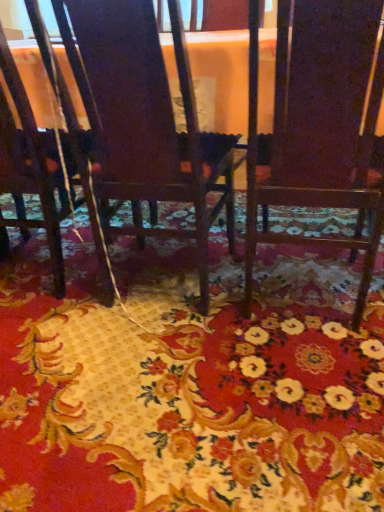
Locate an element on the screen. wooden chair at center, which is counted as the 3th chair, starting from the left is located at coordinates pyautogui.click(x=319, y=123).

What do you see at coordinates (190, 383) in the screenshot?
I see `floral carpet at center` at bounding box center [190, 383].

This screenshot has height=512, width=384. In order to click on wooden chair at center, which is counted as the 3th chair, starting from the left in this screenshot , I will do `click(319, 123)`.

Consider the image. Would you say matte dark wood chair at lower left, which is counted as the first chair, starting from the left, is part of floral carpet at center's contents?

No, matte dark wood chair at lower left, which is counted as the first chair, starting from the left, is not inside floral carpet at center.

How different are the orientations of floral carpet at center and matte dark wood chair at lower left, the third chair positioned from the right, in degrees?

The angular difference between floral carpet at center and matte dark wood chair at lower left, the third chair positioned from the right, is 179 degrees.

From a real-world perspective, does floral carpet at center sit lower than matte dark wood chair at lower left, the third chair positioned from the right?

Yes, from a real-world perspective, floral carpet at center is beneath matte dark wood chair at lower left, the third chair positioned from the right.

From the image's perspective, which is above, floral carpet at center or matte dark wood chair at lower left, the third chair positioned from the right?

From the image's view, matte dark wood chair at lower left, the third chair positioned from the right, is above.

Are wooden chair at center, which is counted as the 3th chair, starting from the left, and matte dark wood chair at lower left, which is counted as the first chair, starting from the left, far apart?

Actually, wooden chair at center, which is counted as the 3th chair, starting from the left, and matte dark wood chair at lower left, which is counted as the first chair, starting from the left, are a little close together.

Where is `the 2nd chair in front of the matte dark wood chair at lower left, which is counted as the first chair, starting from the left`? The image size is (384, 512). the 2nd chair in front of the matte dark wood chair at lower left, which is counted as the first chair, starting from the left is located at coordinates (319, 123).

Who is more distant, wooden chair at center, positioned as the first chair in right-to-left order, or matte dark wood chair at lower left, the third chair positioned from the right?

matte dark wood chair at lower left, the third chair positioned from the right, is behind.

Does wooden chair at center, which is counted as the 3th chair, starting from the left, have a greater width compared to matte dark wood chair at lower left, which is counted as the first chair, starting from the left?

Yes.

Is dark wood chair at center, arranged as the second chair when viewed from the left, completely or partially outside of floral carpet at center?

Absolutely, dark wood chair at center, arranged as the second chair when viewed from the left, is external to floral carpet at center.

How different are the orientations of dark wood chair at center, acting as the second chair starting from the right, and floral carpet at center in degrees?

179 degrees separate the facing orientations of dark wood chair at center, acting as the second chair starting from the right, and floral carpet at center.

Looking at this image, can you confirm if dark wood chair at center, arranged as the second chair when viewed from the left, is smaller than floral carpet at center?

Incorrect, dark wood chair at center, arranged as the second chair when viewed from the left, is not smaller in size than floral carpet at center.

From the image's perspective, is dark wood chair at center, arranged as the second chair when viewed from the left, positioned above or below floral carpet at center?

Clearly, from the image's perspective, dark wood chair at center, arranged as the second chair when viewed from the left, is above floral carpet at center.

Is dark wood chair at center, arranged as the second chair when viewed from the left, looking in the opposite direction of matte dark wood chair at lower left, the third chair positioned from the right?

dark wood chair at center, arranged as the second chair when viewed from the left, is not turned away from matte dark wood chair at lower left, the third chair positioned from the right.

Considering the positions of point (67, 5) and point (1, 164), is point (67, 5) closer or farther from the camera than point (1, 164)?

Point (67, 5).

Considering the relative positions of dark wood chair at center, acting as the second chair starting from the right, and matte dark wood chair at lower left, which is counted as the first chair, starting from the left, in the image provided, is dark wood chair at center, acting as the second chair starting from the right, to the left or to the right of matte dark wood chair at lower left, which is counted as the first chair, starting from the left,?

dark wood chair at center, acting as the second chair starting from the right, is to the right of matte dark wood chair at lower left, which is counted as the first chair, starting from the left.

Is dark wood chair at center, arranged as the second chair when viewed from the left, situated inside matte dark wood chair at lower left, the third chair positioned from the right, or outside?

dark wood chair at center, arranged as the second chair when viewed from the left, is located beyond the bounds of matte dark wood chair at lower left, the third chair positioned from the right.

Considering the sizes of floral carpet at center and wooden chair at center, which is counted as the 3th chair, starting from the left, in the image, is floral carpet at center bigger or smaller than wooden chair at center, which is counted as the 3th chair, starting from the left,?

In the image, floral carpet at center appears to be smaller than wooden chair at center, which is counted as the 3th chair, starting from the left.

Would you say floral carpet at center is inside or outside wooden chair at center, which is counted as the 3th chair, starting from the left?

floral carpet at center is spatially situated outside wooden chair at center, which is counted as the 3th chair, starting from the left.

Does floral carpet at center have a lesser width compared to wooden chair at center, which is counted as the 3th chair, starting from the left?

In fact, floral carpet at center might be wider than wooden chair at center, which is counted as the 3th chair, starting from the left.

The image size is (384, 512). I want to click on mat beneath the wooden chair at center, positioned as the first chair in right-to-left order (from a real-world perspective), so click(x=190, y=383).

Considering the positions of objects floral carpet at center and dark wood chair at center, arranged as the second chair when viewed from the left, in the image provided, who is behind, floral carpet at center or dark wood chair at center, arranged as the second chair when viewed from the left,?

Positioned behind is dark wood chair at center, arranged as the second chair when viewed from the left.

Locate an element on the screen. Image resolution: width=384 pixels, height=512 pixels. the 2nd chair above the floral carpet at center (from a real-world perspective) is located at coordinates (145, 117).

In the image, is floral carpet at center on the left side or the right side of dark wood chair at center, arranged as the second chair when viewed from the left?

floral carpet at center is positioned on dark wood chair at center, arranged as the second chair when viewed from the left,'s left side.

Can you tell me how much floral carpet at center and dark wood chair at center, acting as the second chair starting from the right, differ in facing direction?

They differ by 179 degrees in their facing directions.

From the picture: From the image's perspective, would you say matte dark wood chair at lower left, which is counted as the first chair, starting from the left, is positioned over dark wood chair at center, arranged as the second chair when viewed from the left?

No.

Is the surface of matte dark wood chair at lower left, which is counted as the first chair, starting from the left, in direct contact with dark wood chair at center, arranged as the second chair when viewed from the left?

No.

Is matte dark wood chair at lower left, the third chair positioned from the right, turned away from dark wood chair at center, arranged as the second chair when viewed from the left?

That's not correct — matte dark wood chair at lower left, the third chair positioned from the right, is not looking away from dark wood chair at center, arranged as the second chair when viewed from the left.

Where is `mat that appears in front of the matte dark wood chair at lower left, the third chair positioned from the right`? This screenshot has width=384, height=512. mat that appears in front of the matte dark wood chair at lower left, the third chair positioned from the right is located at coordinates (190, 383).

Locate an element on the screen. This screenshot has width=384, height=512. the 1st chair above the wooden chair at center, positioned as the first chair in right-to-left order (from the image's perspective) is located at coordinates pos(26,164).

From the image, which object appears to be farther from dark wood chair at center, acting as the second chair starting from the right, matte dark wood chair at lower left, the third chair positioned from the right, or wooden chair at center, which is counted as the 3th chair, starting from the left?

matte dark wood chair at lower left, the third chair positioned from the right.

Considering their positions, is dark wood chair at center, acting as the second chair starting from the right, positioned further to floral carpet at center than wooden chair at center, which is counted as the 3th chair, starting from the left?

wooden chair at center, which is counted as the 3th chair, starting from the left, is positioned further to the anchor floral carpet at center.

From the image, which object appears to be farther from matte dark wood chair at lower left, which is counted as the first chair, starting from the left, floral carpet at center or wooden chair at center, which is counted as the 3th chair, starting from the left?

Among the two, wooden chair at center, which is counted as the 3th chair, starting from the left, is located further to matte dark wood chair at lower left, which is counted as the first chair, starting from the left.

Looking at the image, which one is located further to dark wood chair at center, arranged as the second chair when viewed from the left, floral carpet at center or wooden chair at center, positioned as the first chair in right-to-left order?

The object further to dark wood chair at center, arranged as the second chair when viewed from the left, is floral carpet at center.

Looking at the image, which one is located closer to dark wood chair at center, acting as the second chair starting from the right, wooden chair at center, positioned as the first chair in right-to-left order, or matte dark wood chair at lower left, which is counted as the first chair, starting from the left?

wooden chair at center, positioned as the first chair in right-to-left order.

Considering their positions, is floral carpet at center positioned closer to wooden chair at center, which is counted as the 3th chair, starting from the left, than matte dark wood chair at lower left, the third chair positioned from the right?

floral carpet at center is positioned closer to the anchor wooden chair at center, which is counted as the 3th chair, starting from the left.

Based on their spatial positions, is dark wood chair at center, arranged as the second chair when viewed from the left, or matte dark wood chair at lower left, the third chair positioned from the right, further from wooden chair at center, which is counted as the 3th chair, starting from the left?

matte dark wood chair at lower left, the third chair positioned from the right, is further to wooden chair at center, which is counted as the 3th chair, starting from the left.

Estimate the real-world distances between objects in this image. Which object is further from floral carpet at center, matte dark wood chair at lower left, the third chair positioned from the right, or wooden chair at center, positioned as the first chair in right-to-left order?

Based on the image, matte dark wood chair at lower left, the third chair positioned from the right, appears to be further to floral carpet at center.

Identify the location of chair between matte dark wood chair at lower left, the third chair positioned from the right, and wooden chair at center, positioned as the first chair in right-to-left order, in the horizontal direction. This screenshot has width=384, height=512. (145, 117).

The width and height of the screenshot is (384, 512). Find the location of `mat between matte dark wood chair at lower left, the third chair positioned from the right, and wooden chair at center, positioned as the first chair in right-to-left order, in the horizontal direction`. mat between matte dark wood chair at lower left, the third chair positioned from the right, and wooden chair at center, positioned as the first chair in right-to-left order, in the horizontal direction is located at coordinates (190, 383).

Identify the location of chair between floral carpet at center and wooden chair at center, which is counted as the 3th chair, starting from the left. The width and height of the screenshot is (384, 512). (145, 117).